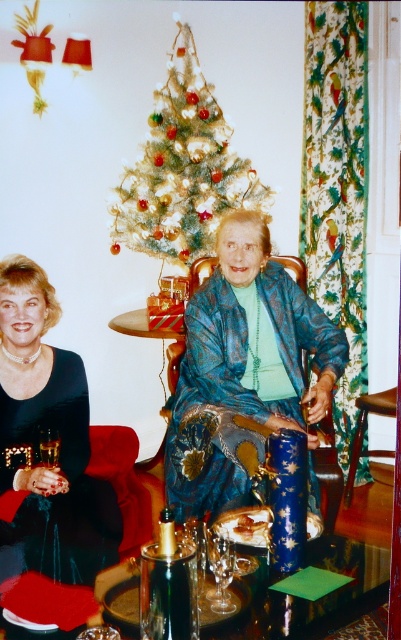
In the scene shown: Does blue textured dress at center have a greater width compared to translucent glass bottle at lower left?

Yes.

Consider the image. Between blue textured dress at center and translucent glass bottle at lower left, which one has less height?

translucent glass bottle at lower left is shorter.

Identify the location of blue textured dress at center. The image size is (401, 640). (243, 365).

Describe the element at coordinates (182, 168) in the screenshot. This screenshot has height=640, width=401. I see `white frosted christmas tree at center` at that location.

Which is behind, point (178, 216) or point (216, 545)?

Point (178, 216)

At what (x,y) coordinates should I click in order to perform the action: click on white frosted christmas tree at center. Please return your answer as a coordinate pair (x, y). Looking at the image, I should click on (182, 168).

Which is behind, point (12, 288) or point (52, 436)?

The point (52, 436) is more distant.

How distant is black velvet dress at left from translucent glass bottle at lower left?

A distance of 8.84 inches exists between black velvet dress at left and translucent glass bottle at lower left.

Which is behind, point (70, 564) or point (44, 442)?

Positioned behind is point (44, 442).

At what (x,y) coordinates should I click in order to perform the action: click on black velvet dress at left. Please return your answer as a coordinate pair (x, y). Looking at the image, I should click on (52, 435).